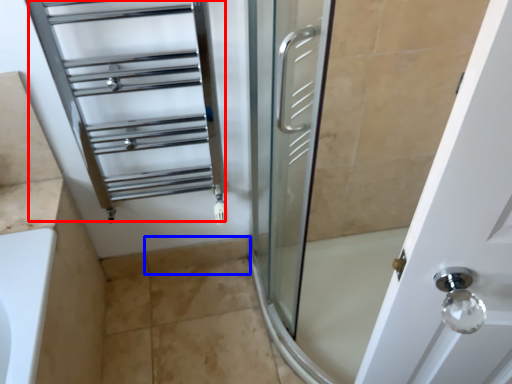
Question: Which object appears closest to the camera in this image, cage (highlighted by a red box) or tile (highlighted by a blue box)?

Choices:
 (A) cage
 (B) tile

Answer: (A)